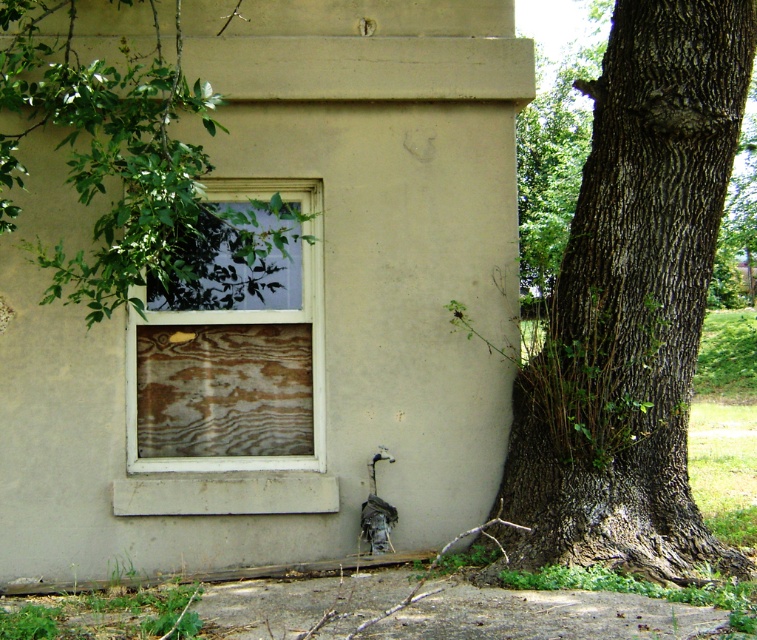
Is dark brown textured bark at right further to camera compared to wooden panel at center?

No, dark brown textured bark at right is closer to the viewer.

Locate an element on the screen. dark brown textured bark at right is located at coordinates (634, 304).

Who is more distant from viewer, (617,365) or (273,358)?

The point (273,358) is behind.

I want to click on dark brown textured bark at right, so click(x=634, y=304).